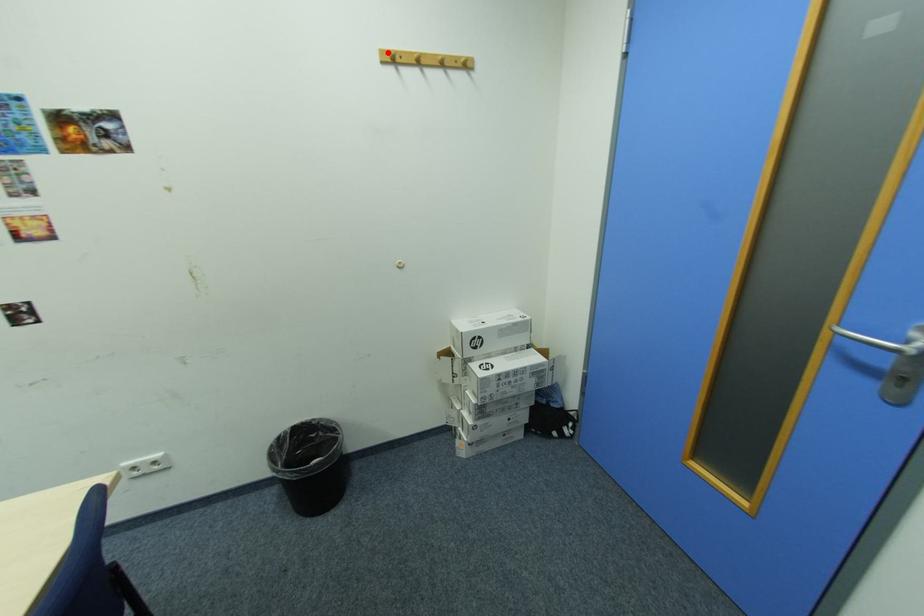
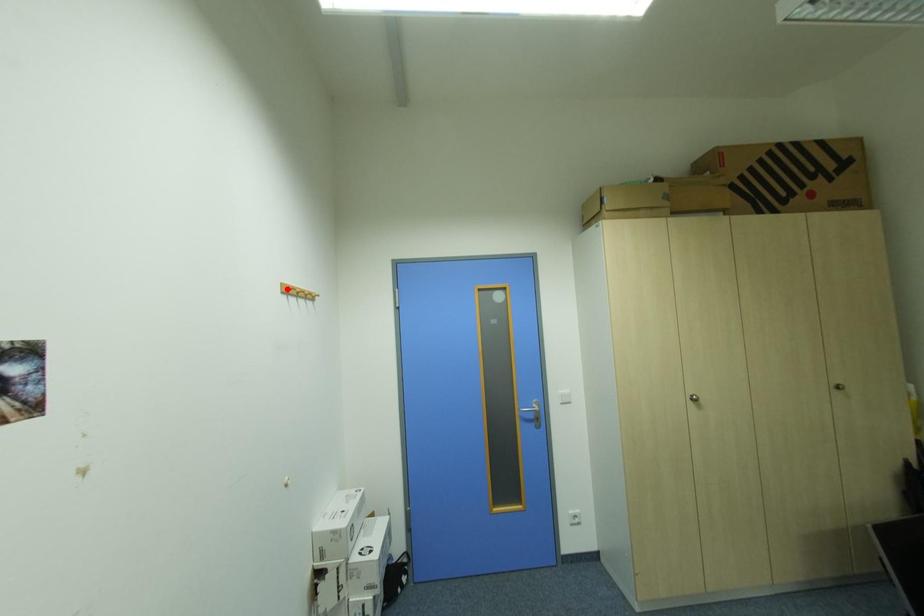
I am providing you with two images of the same scene from different viewpoints. A red point is marked on the first image and another point is marked on the second image. Do the highlighted points in image1 and image2 indicate the same real-world spot?

No